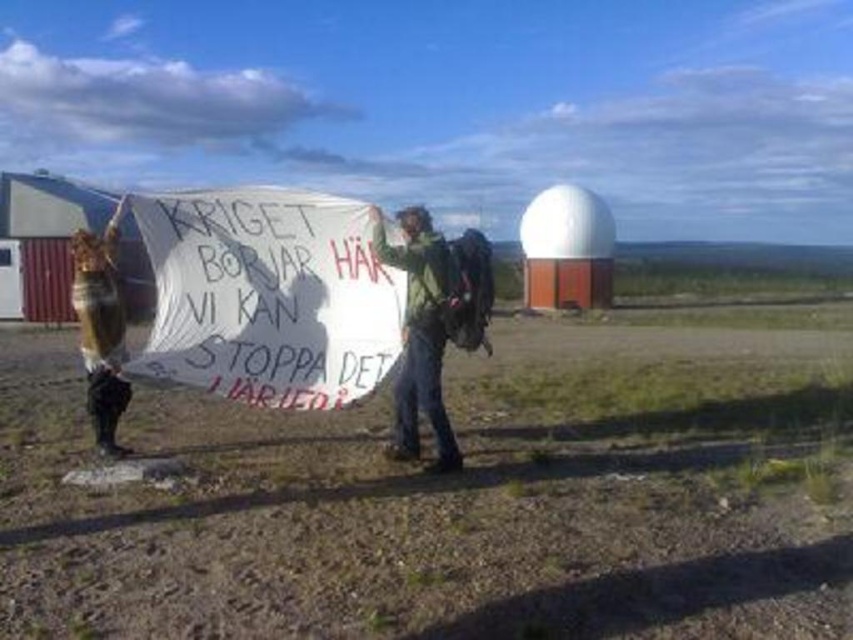
You are a photographer trying to capture the protest scene. You notice the white paper sign at center and the green fabric at center. Which object should you focus on first if you want to include both in your frame without moving the camera?

You should focus on the green fabric at center first because the white paper sign at center is above it, so adjusting focus to the lower object ensures both are in the frame.

You are a photographer at the center of the scene. You want to take a photo that includes both the white paper sign at center and the green fabric at center. Which object will appear smaller in the photo?

The white paper sign at center will appear smaller in the photo because it has a lesser height compared to the green fabric at center.